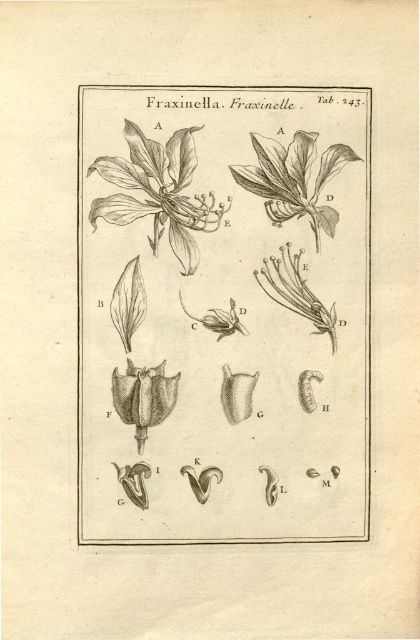
Question: Can you confirm if brown textured flower at upper left is smaller than brown wood flower at upper center?

Choices:
 (A) yes
 (B) no

Answer: (B)

Question: Based on their relative distances, which object is farther from the black ink drawing of flower at upper center?

Choices:
 (A) brown wood flower at upper center
 (B) brown textured flower at upper left

Answer: (A)

Question: Based on their relative distances, which object is nearer to the brown wood flower at upper center?

Choices:
 (A) brown textured flower at upper left
 (B) black ink drawing of flower at upper center

Answer: (A)

Question: Is black ink drawing of flower at upper center bigger than brown wood flower at upper center?

Choices:
 (A) no
 (B) yes

Answer: (B)

Question: Does brown textured flower at upper left appear under brown wood flower at upper center?

Choices:
 (A) no
 (B) yes

Answer: (B)

Question: Which object is closer to the camera taking this photo?

Choices:
 (A) brown wood flower at upper center
 (B) black ink drawing of flower at upper center

Answer: (B)